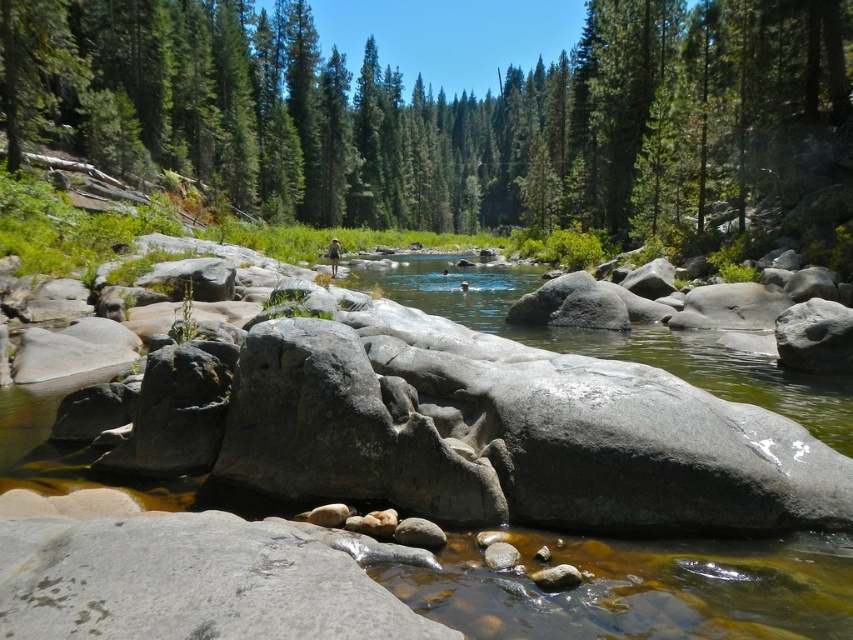
Looking at this image, is green matte forest at center smaller than gray rock pool at center?

No, green matte forest at center is not smaller than gray rock pool at center.

Between green matte forest at center and gray rock pool at center, which one is positioned higher?

green matte forest at center

Is point (366, 81) behind point (390, 272)?

Yes.

This screenshot has height=640, width=853. Identify the location of green matte forest at center. (447, 113).

Between point (334, 221) and point (514, 563), which one is positioned in front?

Positioned in front is point (514, 563).

Between green matte forest at center and smooth gray rock at center, which one has more height?

With more height is green matte forest at center.

Is point (671, 189) positioned in front of point (512, 560)?

No, (671, 189) is behind (512, 560).

Find the location of a particular element. green matte forest at center is located at coordinates (447, 113).

The height and width of the screenshot is (640, 853). Describe the element at coordinates (614, 340) in the screenshot. I see `gray rock pool at center` at that location.

I want to click on gray rock pool at center, so click(614, 340).

The height and width of the screenshot is (640, 853). What do you see at coordinates (614, 340) in the screenshot?
I see `gray rock pool at center` at bounding box center [614, 340].

Where is `gray rock pool at center`? This screenshot has height=640, width=853. gray rock pool at center is located at coordinates (614, 340).